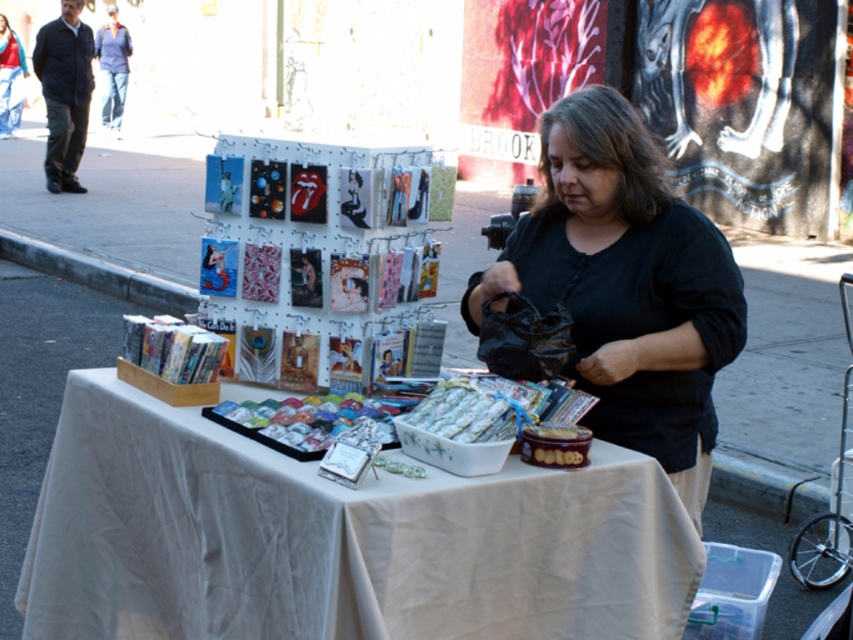
Can you confirm if black cotton shirt at center is wider than white glossy bowl at center?

Indeed, black cotton shirt at center has a greater width compared to white glossy bowl at center.

The image size is (853, 640). Describe the element at coordinates (625, 285) in the screenshot. I see `black cotton shirt at center` at that location.

This screenshot has height=640, width=853. Find the location of `black cotton shirt at center`. black cotton shirt at center is located at coordinates (625, 285).

Does black leather jacket at upper left have a greater width compared to white glossy bowl at center?

Correct, the width of black leather jacket at upper left exceeds that of white glossy bowl at center.

From the picture: Between black leather jacket at upper left and white glossy bowl at center, which one appears on the left side from the viewer's perspective?

black leather jacket at upper left is more to the left.

The image size is (853, 640). Describe the element at coordinates (64, 92) in the screenshot. I see `black leather jacket at upper left` at that location.

This screenshot has height=640, width=853. Identify the location of black leather jacket at upper left. (64, 92).

The image size is (853, 640). Describe the element at coordinates (625, 285) in the screenshot. I see `black cotton shirt at center` at that location.

Consider the image. Who is taller, black cotton shirt at center or black leather jacket at upper left?

black leather jacket at upper left

Is point (723, 248) more distant than point (85, 51)?

That is False.

Find the location of `black cotton shirt at center`. black cotton shirt at center is located at coordinates (625, 285).